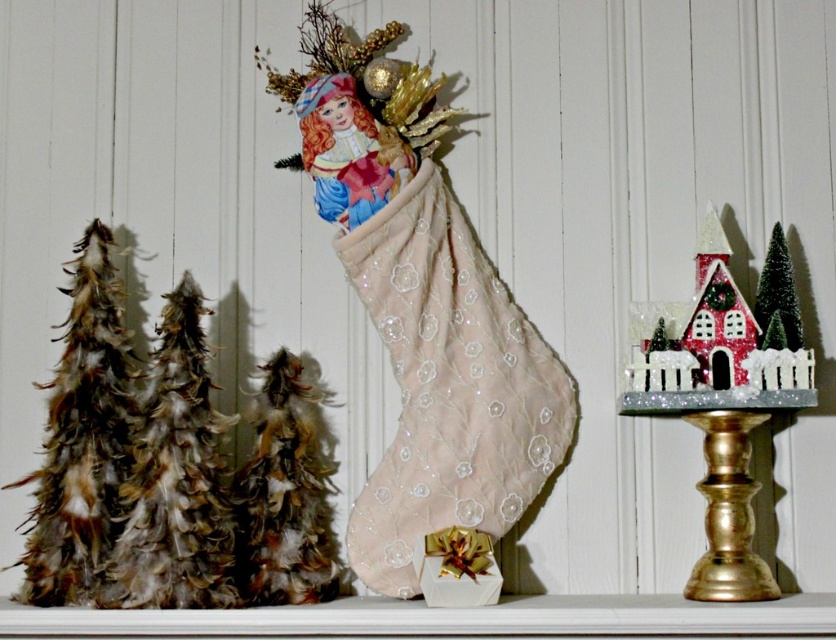
Question: Is feathered brown christmas tree at left further to the viewer compared to green feathery christmas tree at right?

Choices:
 (A) no
 (B) yes

Answer: (A)

Question: Is feathered brown christmas trees at left positioned before feathered brown christmas tree at left?

Choices:
 (A) yes
 (B) no

Answer: (A)

Question: Which of the following is the closest to the observer?

Choices:
 (A) feathered brown christmas tree at left
 (B) green feathery christmas tree at right
 (C) feathered christmas tree at left

Answer: (C)

Question: Among these points, which one is nearest to the camera?

Choices:
 (A) coord(72,397)
 (B) coord(182,374)

Answer: (B)

Question: Is feathered christmas tree at left thinner than green feathery christmas tree at right?

Choices:
 (A) yes
 (B) no

Answer: (B)

Question: Among these points, which one is nearest to the camera?

Choices:
 (A) (252, 401)
 (B) (115, 532)
 (C) (773, 292)

Answer: (B)